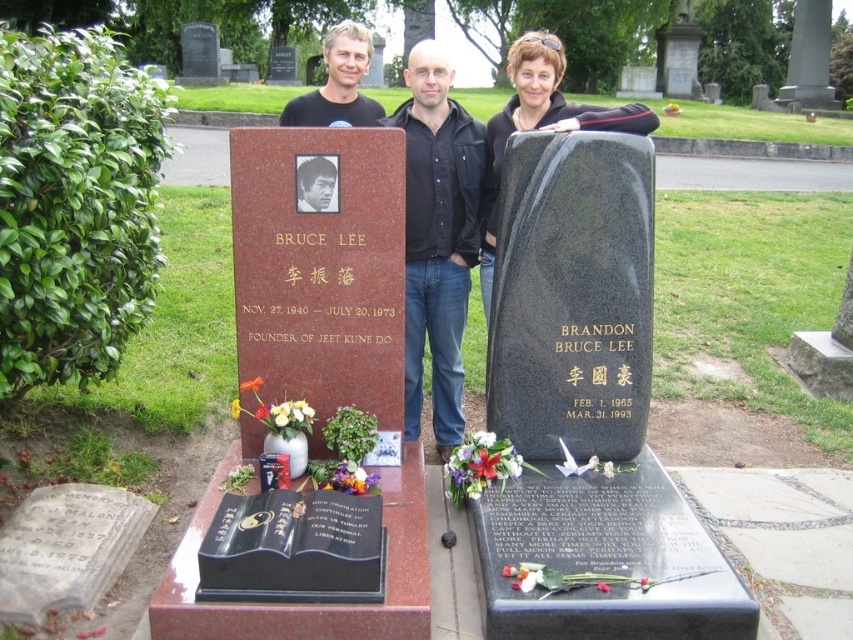
How distant is matte black granite statue at center from blonde hair at center?

A distance of 6.48 meters exists between matte black granite statue at center and blonde hair at center.

Which is in front, point (422, 234) or point (343, 51)?

Point (422, 234)

Between point (421, 58) and point (351, 28), which one is positioned in front?

Point (421, 58) is more forward.

Where is `matte black granite statue at center`? The image size is (853, 640). matte black granite statue at center is located at coordinates (424, 212).

In order to click on matte black jacket at center in this screenshot , I will do `click(541, 122)`.

Looking at this image, who is shorter, matte black jacket at center or blonde hair at center?

blonde hair at center is shorter.

Which is in front, point (495, 221) or point (350, 33)?

Point (495, 221) is in front.

Locate an element on the screen. This screenshot has width=853, height=640. matte black jacket at center is located at coordinates (541, 122).

Does matte black granite statue at center come in front of black matte shirt at center?

No.

Consider the image. Measure the distance between matte black granite statue at center and black matte shirt at center.

A distance of 38.31 centimeters exists between matte black granite statue at center and black matte shirt at center.

The width and height of the screenshot is (853, 640). Describe the element at coordinates (424, 212) in the screenshot. I see `matte black granite statue at center` at that location.

Find the location of a particular element. matte black granite statue at center is located at coordinates (424, 212).